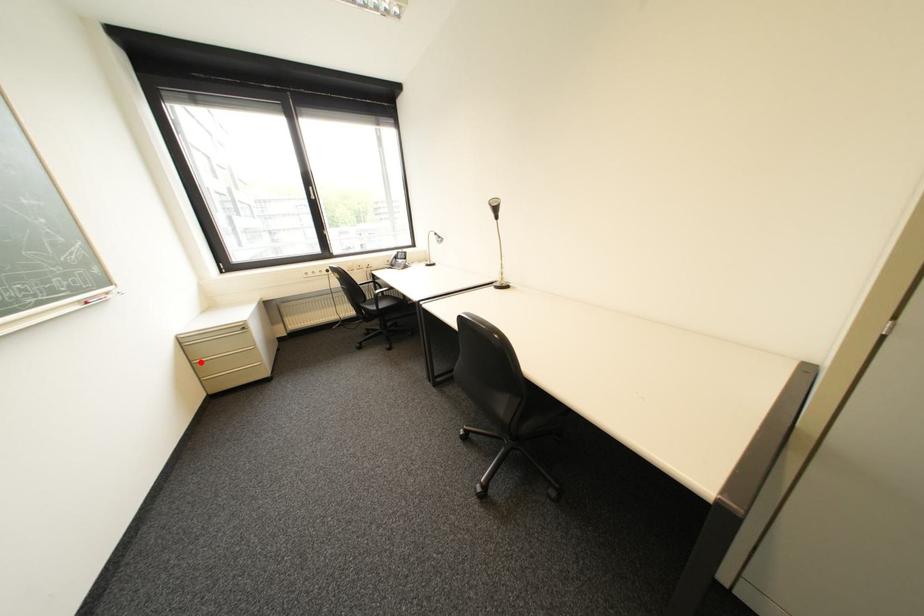
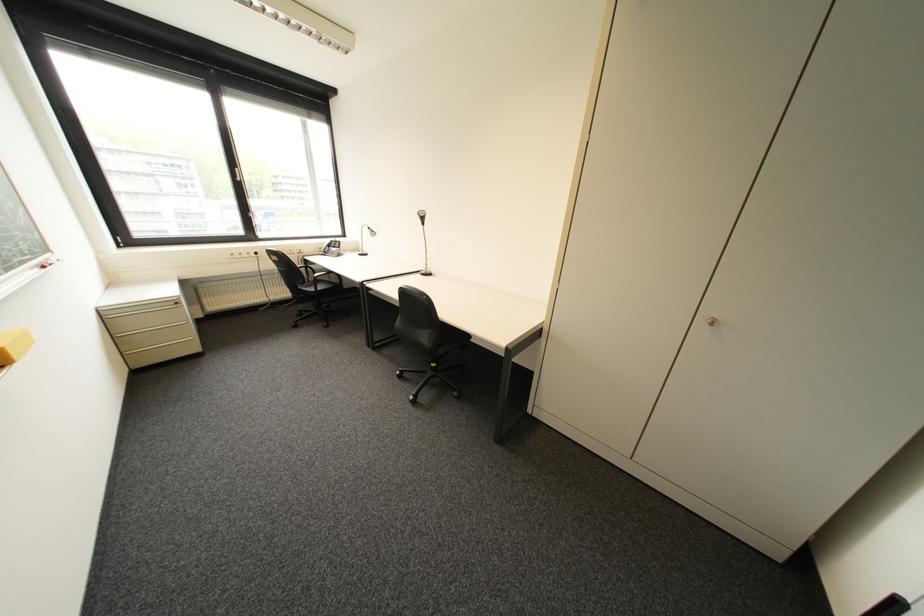
Find the pixel in the second image that matches the highlighted location in the first image.

(122, 336)